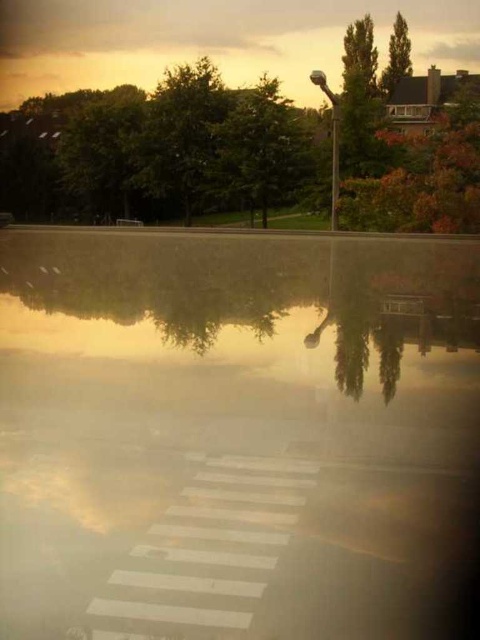
Can you confirm if transparent glass water at center is positioned to the right of autumn leaves at upper right?

Incorrect, transparent glass water at center is not on the right side of autumn leaves at upper right.

Find the location of `transparent glass water at center`. transparent glass water at center is located at coordinates (236, 435).

Does transparent glass water at center have a lesser width compared to green leafy tree at upper right?

No.

Is transparent glass water at center above green leafy tree at upper right?

No, transparent glass water at center is not above green leafy tree at upper right.

Who is more distant from viewer, (396, 536) or (394, 45)?

The point (394, 45) is more distant.

Find the location of a particular element. This screenshot has height=640, width=480. transparent glass water at center is located at coordinates (236, 435).

Does point (396, 154) come behind point (400, 13)?

No, it is in front of (400, 13).

Measure the distance between autumn leaves at upper right and camera.

21.69 meters

Between point (409, 216) and point (399, 60), which one is positioned behind?

Positioned behind is point (399, 60).

Where is `autumn leaves at upper right`? autumn leaves at upper right is located at coordinates (422, 177).